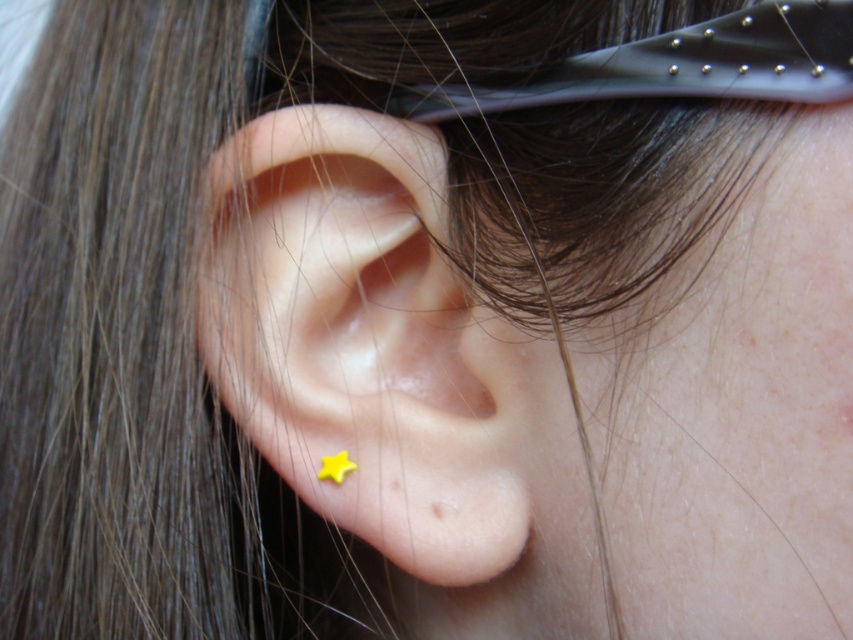
Question: Among these objects, which one is farthest from the camera?

Choices:
 (A) yellow matte star at ear
 (B) yellow matte star at center

Answer: (A)

Question: Can you confirm if yellow matte star at center is wider than yellow matte star at ear?

Choices:
 (A) no
 (B) yes

Answer: (B)

Question: Is yellow matte star at center behind yellow matte star at ear?

Choices:
 (A) yes
 (B) no

Answer: (B)

Question: Which object appears farthest from the camera in this image?

Choices:
 (A) yellow matte star at ear
 (B) yellow matte star at center

Answer: (A)

Question: Does yellow matte star at center lie behind yellow matte star at ear?

Choices:
 (A) yes
 (B) no

Answer: (B)